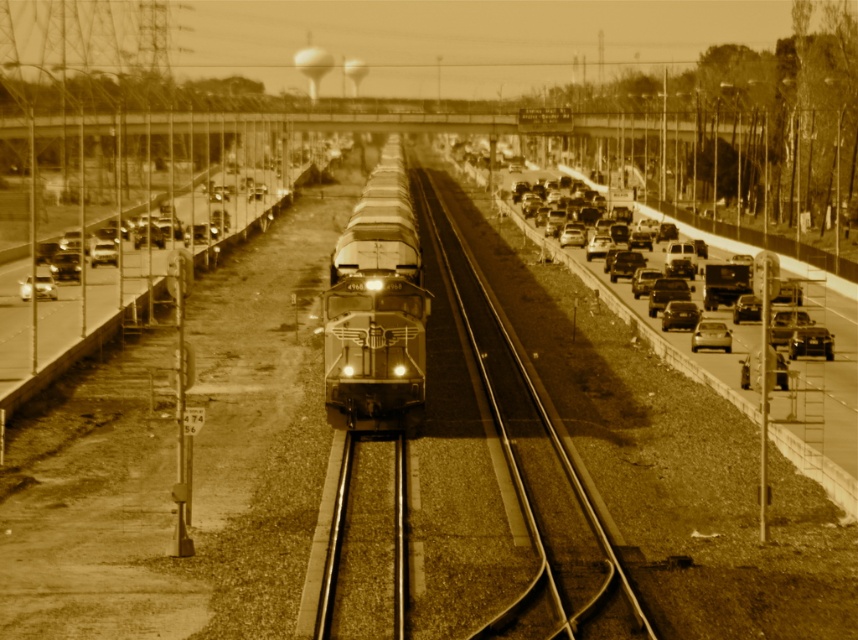
Can you confirm if shiny black locomotive at center is bigger than shiny silver sedan at center right?

Yes.

The height and width of the screenshot is (640, 858). What do you see at coordinates (376, 307) in the screenshot?
I see `shiny black locomotive at center` at bounding box center [376, 307].

Is point (412, 269) in front of point (681, 323)?

Yes, point (412, 269) is closer to viewer.

The image size is (858, 640). What are the coordinates of `shiny black locomotive at center` in the screenshot? It's located at (376, 307).

Who is higher up, shiny black locomotive at center or metallic silver sedan at left?

shiny black locomotive at center

Can you confirm if shiny black locomotive at center is wider than metallic silver sedan at left?

Incorrect, shiny black locomotive at center's width does not surpass metallic silver sedan at left's.

Between point (375, 317) and point (52, 284), which one is positioned behind?

The point (52, 284) is behind.

Where is `shiny black locomotive at center`? The width and height of the screenshot is (858, 640). shiny black locomotive at center is located at coordinates (376, 307).

Which of these two, shiny black sedan at right or shiny silver sedan at center right, stands shorter?

With less height is shiny silver sedan at center right.

From the picture: Which of these two, shiny black sedan at right or shiny silver sedan at center right, stands taller?

shiny black sedan at right

What are the coordinates of `shiny black sedan at right` in the screenshot? It's located at (810, 342).

Find the location of `shiny black sedan at right`. shiny black sedan at right is located at coordinates (810, 342).